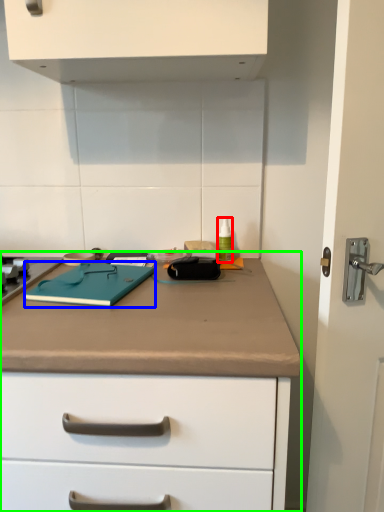
Question: Which is farther away from bottle (highlighted by a red box)? notebook (highlighted by a blue box) or counter (highlighted by a green box)?

Choices:
 (A) notebook
 (B) counter

Answer: (B)